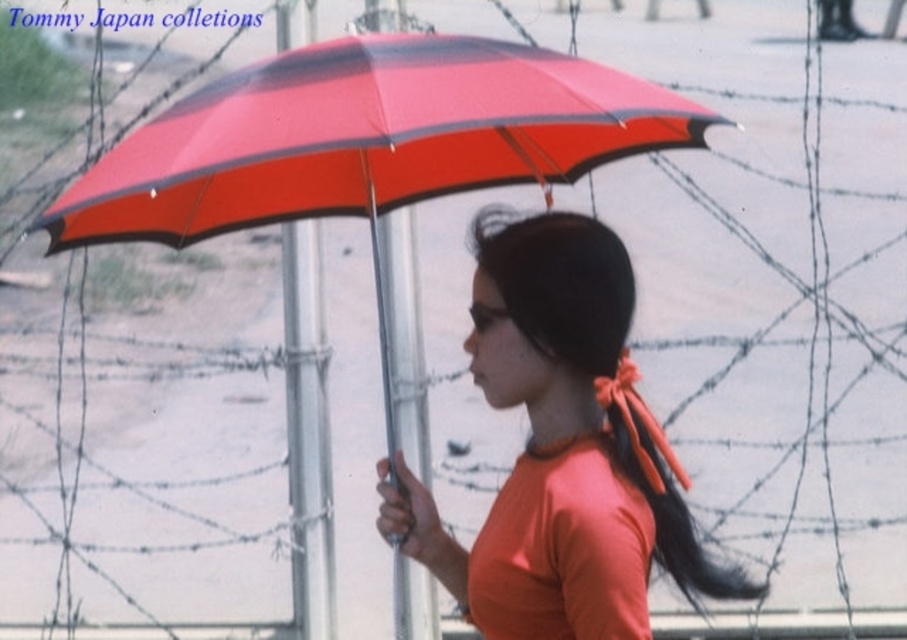
Is orange matte shirt at center above orange fabric ponytail at center?

Indeed, orange matte shirt at center is positioned over orange fabric ponytail at center.

Measure the distance between point (x=417, y=524) and camera.

Point (x=417, y=524) and camera are 3.04 meters apart from each other.

This screenshot has height=640, width=907. I want to click on orange matte shirt at center, so click(x=579, y=384).